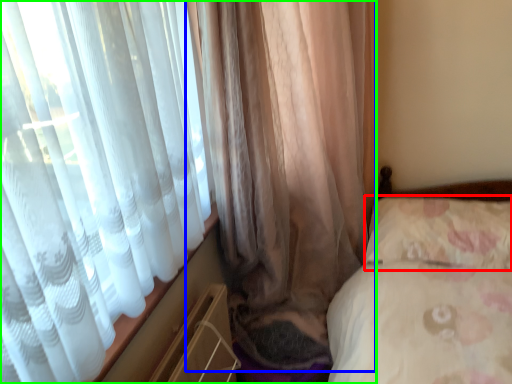
Question: Estimate the real-world distances between objects in this image. Which object is closer to pillow (highlighted by a red box), curtain (highlighted by a blue box) or curtain (highlighted by a green box)?

Choices:
 (A) curtain
 (B) curtain

Answer: (A)